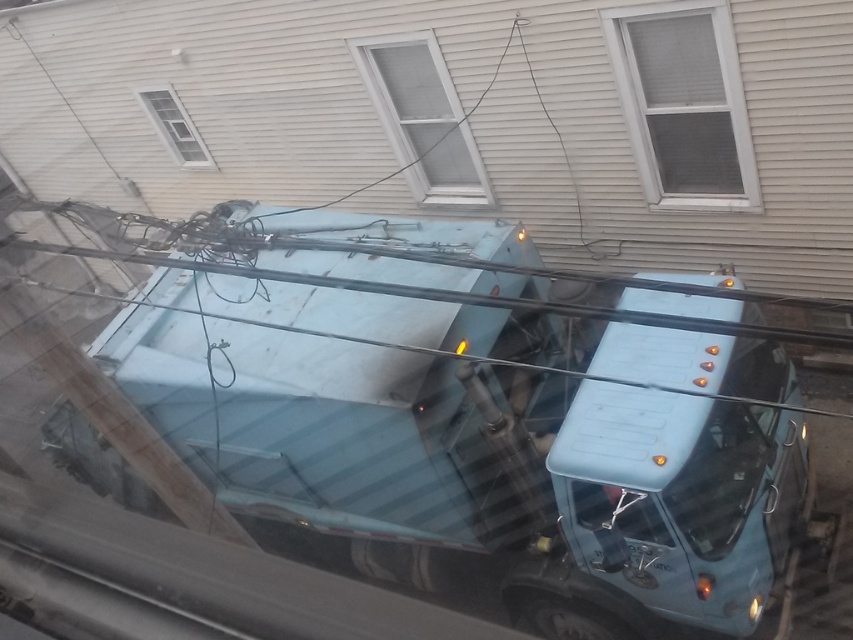
Question: Which of the following is the closest to the observer?

Choices:
 (A) white textured window at center
 (B) white mesh screen at upper center
 (C) light blue metallic garbage truck at center
 (D) white textured window at upper left

Answer: (C)

Question: Which is farther from the white mesh screen at upper center?

Choices:
 (A) white textured window at upper left
 (B) light blue metallic garbage truck at center

Answer: (A)

Question: Which object appears farthest from the camera in this image?

Choices:
 (A) white textured window at upper left
 (B) light blue metallic garbage truck at center

Answer: (A)

Question: Where is light blue metallic garbage truck at center located in relation to white mesh screen at upper center in the image?

Choices:
 (A) right
 (B) left

Answer: (B)

Question: Does white textured window at center have a smaller size compared to white textured window at upper left?

Choices:
 (A) yes
 (B) no

Answer: (B)

Question: Does light blue metallic garbage truck at center have a larger size compared to white textured window at center?

Choices:
 (A) yes
 (B) no

Answer: (A)